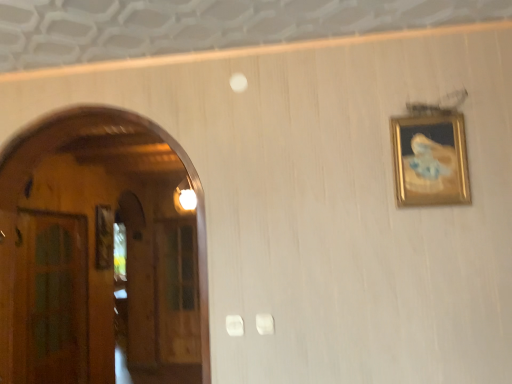
Question: Does point (400, 147) appear closer or farther from the camera than point (183, 286)?

Choices:
 (A) closer
 (B) farther

Answer: (A)

Question: Is gold-framed painting at upper right situated inside transparent wooden door at left, marked as the 1th glass door in a back-to-front arrangement, or outside?

Choices:
 (A) inside
 (B) outside

Answer: (B)

Question: Considering the real-world distances, which object is closest to the green glass door at left, which is the 2th glass door in back-to-front order?

Choices:
 (A) gold-framed painting at upper right
 (B) transparent wooden door at left, arranged as the 1th glass door when viewed from the right

Answer: (B)

Question: Which object is positioned closest to the transparent wooden door at left, acting as the second glass door starting from the left?

Choices:
 (A) gold-framed painting at upper right
 (B) green glass door at left, placed as the first glass door when sorted from left to right

Answer: (B)